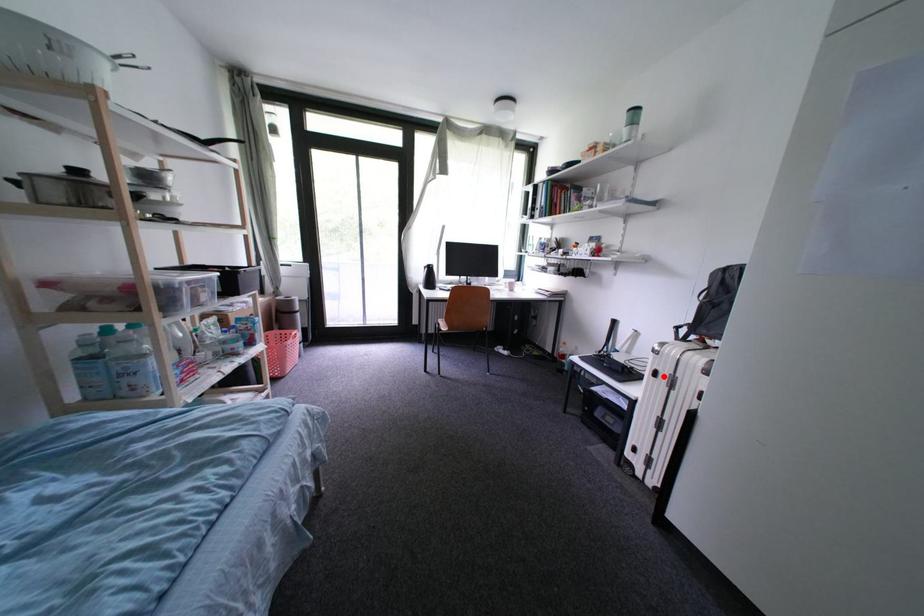
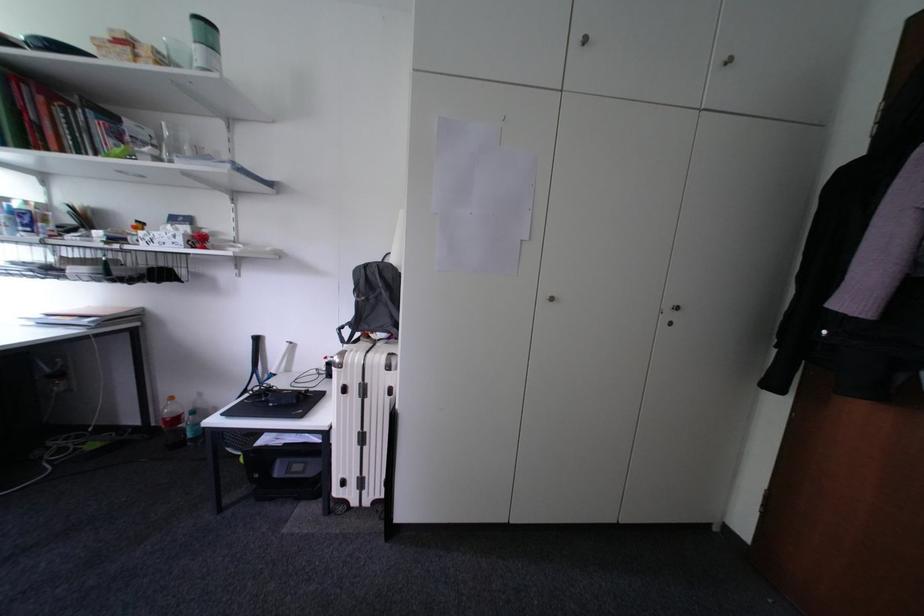
Question: I am providing you with two images of the same scene from different viewpoints. Image1 has a red point marked. In image2, the corresponding 3D location appears at what relative position? Reply with the corresponding letter.

Choices:
 (A) Closer
 (B) Farther

Answer: (B)